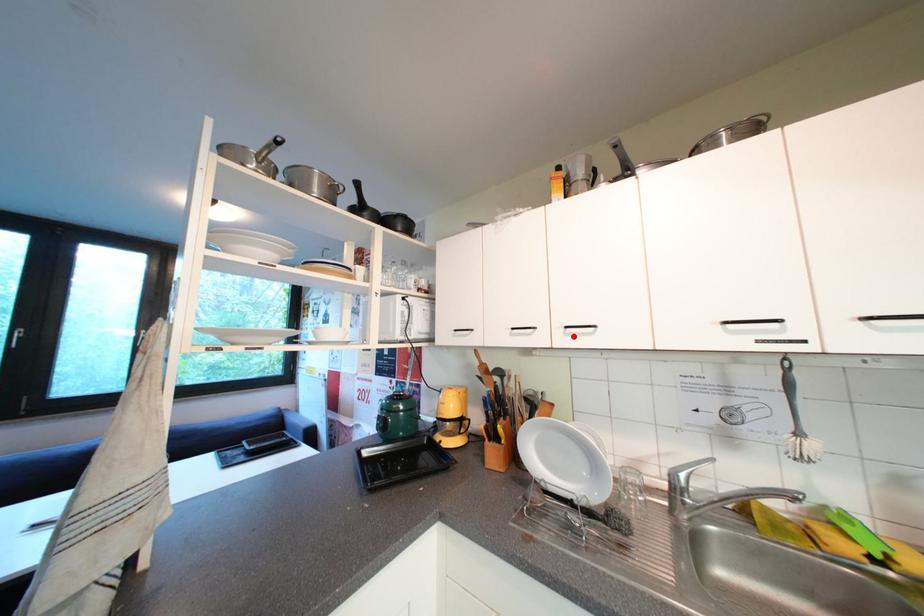
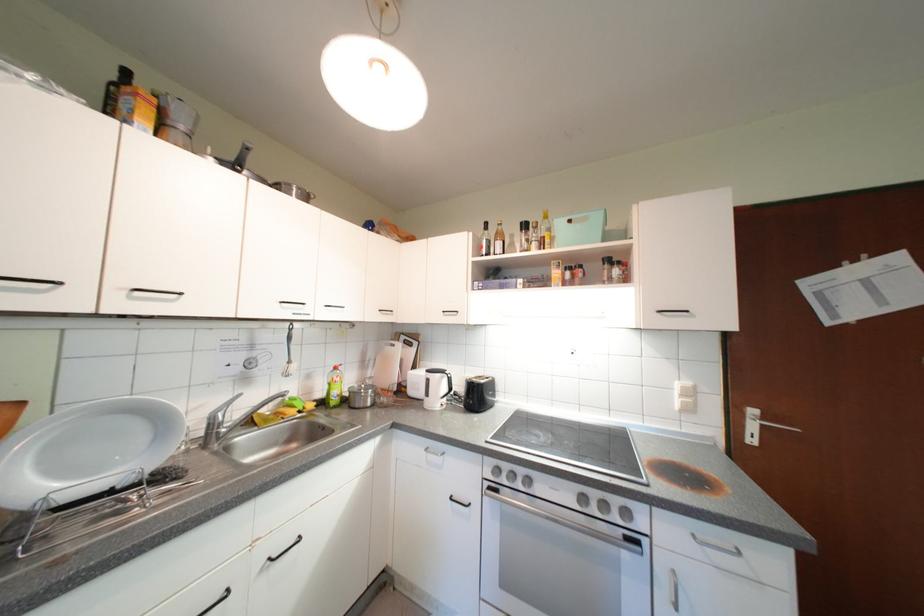
In the second image, find the point that corresponds to the highlighted location in the first image.

(139, 300)